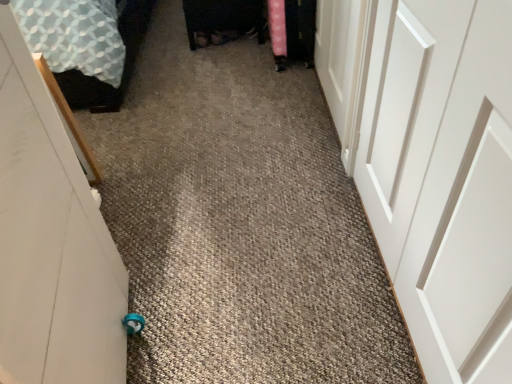
Question: Are white matte door at left, marked as the 3th door in a right-to-left arrangement, and white smooth door at right, the third door viewed from the left, beside each other?

Choices:
 (A) yes
 (B) no

Answer: (B)

Question: Would you say white matte door at left, placed as the first door when sorted from left to right, contains white smooth door at right, the third door viewed from the left?

Choices:
 (A) no
 (B) yes

Answer: (A)

Question: From the image's perspective, is white matte door at left, marked as the 3th door in a right-to-left arrangement, under white smooth door at right, the third door viewed from the left?

Choices:
 (A) no
 (B) yes

Answer: (B)

Question: From a real-world perspective, is white matte door at left, placed as the first door when sorted from left to right, physically above white smooth door at right, the third door viewed from the left?

Choices:
 (A) no
 (B) yes

Answer: (B)

Question: Is white matte door at left, placed as the first door when sorted from left to right, smaller than white smooth door at right, the third door viewed from the left?

Choices:
 (A) yes
 (B) no

Answer: (B)

Question: Does white matte door at left, marked as the 3th door in a right-to-left arrangement, have a lesser width compared to white smooth door at right, the third door viewed from the left?

Choices:
 (A) no
 (B) yes

Answer: (A)

Question: Is white smooth door at right, which is counted as the first door, starting from the right, touching patterned fabric bed at left?

Choices:
 (A) yes
 (B) no

Answer: (B)

Question: From the image's perspective, is white smooth door at right, which is counted as the first door, starting from the right, on patterned fabric bed at left?

Choices:
 (A) yes
 (B) no

Answer: (B)

Question: Does white smooth door at right, which is counted as the first door, starting from the right, appear on the right side of patterned fabric bed at left?

Choices:
 (A) yes
 (B) no

Answer: (A)

Question: Can you confirm if white smooth door at right, the third door viewed from the left, is taller than patterned fabric bed at left?

Choices:
 (A) yes
 (B) no

Answer: (A)

Question: Considering the relative positions of white smooth door at right, the third door viewed from the left, and patterned fabric bed at left in the image provided, is white smooth door at right, the third door viewed from the left, to the left of patterned fabric bed at left from the viewer's perspective?

Choices:
 (A) yes
 (B) no

Answer: (B)

Question: Can you confirm if white smooth door at right, the third door viewed from the left, is thinner than patterned fabric bed at left?

Choices:
 (A) no
 (B) yes

Answer: (B)

Question: Can white matte door at left, marked as the 3th door in a right-to-left arrangement, be found inside white matte door at upper right, positioned as the 2th door in right-to-left order?

Choices:
 (A) no
 (B) yes

Answer: (A)